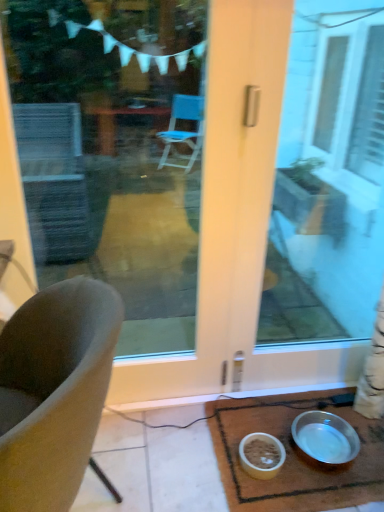
At what (x,y) coordinates should I click in order to perform the action: click on free location above metallic silver bowl at lower right (from a real-world perspective). Please return your answer as a coordinate pair (x, y). Looking at the image, I should click on (307, 438).